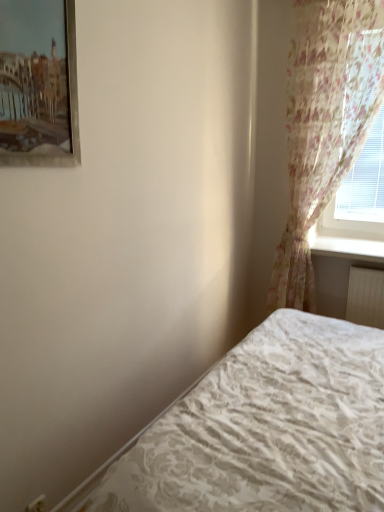
Question: Does floral sheer curtain at right have a lesser height compared to white textured bed at lower right?

Choices:
 (A) no
 (B) yes

Answer: (A)

Question: Can we say floral sheer curtain at right lies outside white textured bed at lower right?

Choices:
 (A) no
 (B) yes

Answer: (B)

Question: Does floral sheer curtain at right come behind white textured bed at lower right?

Choices:
 (A) no
 (B) yes

Answer: (B)

Question: From a real-world perspective, is floral sheer curtain at right positioned over white textured bed at lower right based on gravity?

Choices:
 (A) yes
 (B) no

Answer: (A)

Question: Considering the relative sizes of floral sheer curtain at right and white textured bed at lower right in the image provided, is floral sheer curtain at right wider than white textured bed at lower right?

Choices:
 (A) no
 (B) yes

Answer: (A)

Question: From the image's perspective, is floral sheer curtain at right over white textured bed at lower right?

Choices:
 (A) no
 (B) yes

Answer: (B)

Question: Can you confirm if white glossy window sill at upper right is smaller than white textured bed at lower right?

Choices:
 (A) yes
 (B) no

Answer: (A)

Question: From the image's perspective, is white glossy window sill at upper right over white textured bed at lower right?

Choices:
 (A) yes
 (B) no

Answer: (A)

Question: Could white textured bed at lower right be considered to be inside white glossy window sill at upper right?

Choices:
 (A) no
 (B) yes

Answer: (A)

Question: From a real-world perspective, is white glossy window sill at upper right beneath white textured bed at lower right?

Choices:
 (A) yes
 (B) no

Answer: (B)

Question: From a real-world perspective, is white glossy window sill at upper right located higher than white textured bed at lower right?

Choices:
 (A) no
 (B) yes

Answer: (B)

Question: Is white glossy window sill at upper right wider than white textured bed at lower right?

Choices:
 (A) yes
 (B) no

Answer: (B)

Question: Is metallic silver picture frame at upper left to the left of white textured bed at lower right from the viewer's perspective?

Choices:
 (A) no
 (B) yes

Answer: (B)